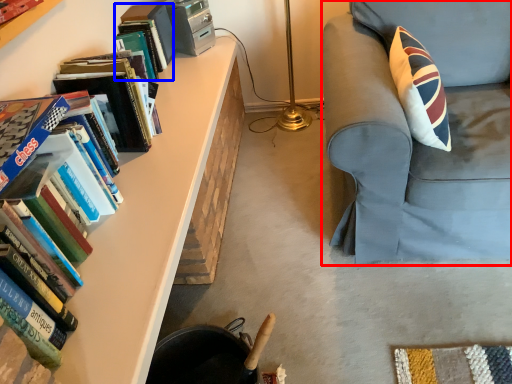
Question: Which of the following is the farthest to the observer, chair (highlighted by a red box) or book (highlighted by a blue box)?

Choices:
 (A) chair
 (B) book

Answer: (B)